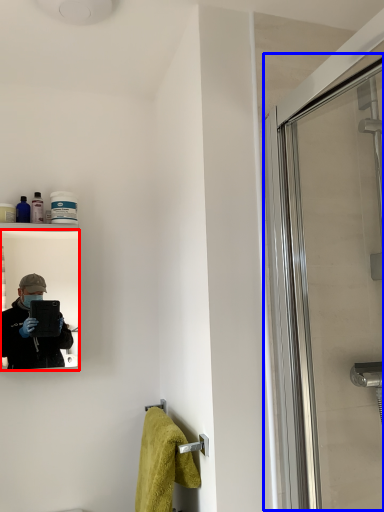
Question: Among these objects, which one is nearest to the camera, mirror (highlighted by a red box) or screen door (highlighted by a blue box)?

Choices:
 (A) mirror
 (B) screen door

Answer: (B)